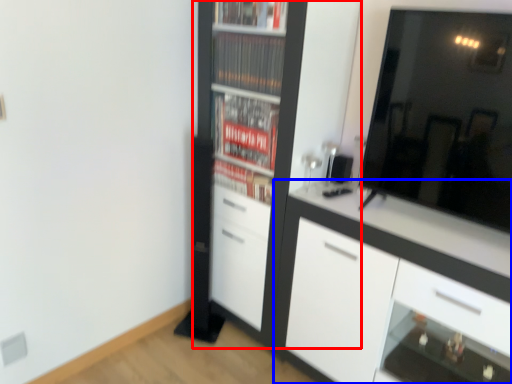
Question: Which of the following is the closest to the observer, cupboard (highlighted by a red box) or cabinetry (highlighted by a blue box)?

Choices:
 (A) cupboard
 (B) cabinetry

Answer: (B)